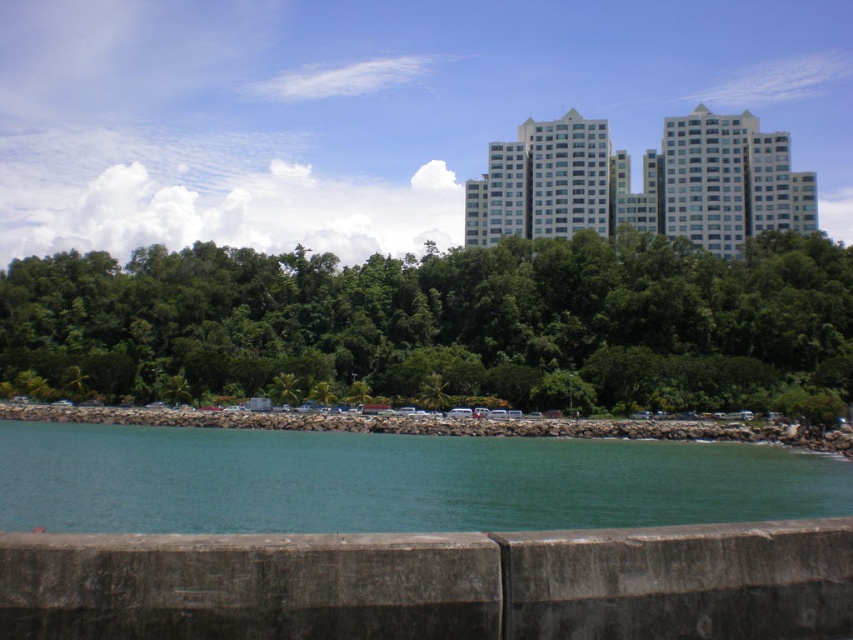
Question: Can you confirm if green leafy trees at center is positioned to the right of white glossy building at upper center?

Choices:
 (A) no
 (B) yes

Answer: (A)

Question: Is concrete at lower center below gray rock shoreline at lower center?

Choices:
 (A) yes
 (B) no

Answer: (B)

Question: Can you confirm if white glossy building at upper center is smaller than gray rock shoreline at lower center?

Choices:
 (A) yes
 (B) no

Answer: (B)

Question: Which of the following is the closest to the observer?

Choices:
 (A) (529, 209)
 (B) (689, 298)
 (C) (198, 416)
 (D) (811, 577)

Answer: (D)

Question: Which object is positioned farthest from the concrete at lower center?

Choices:
 (A) gray rock shoreline at lower center
 (B) green leafy trees at center

Answer: (B)

Question: Which of these objects is positioned farthest from the concrete at lower center?

Choices:
 (A) gray rock shoreline at lower center
 (B) green leafy trees at center
 (C) teal water at lower center
 (D) white glossy building at upper center

Answer: (D)